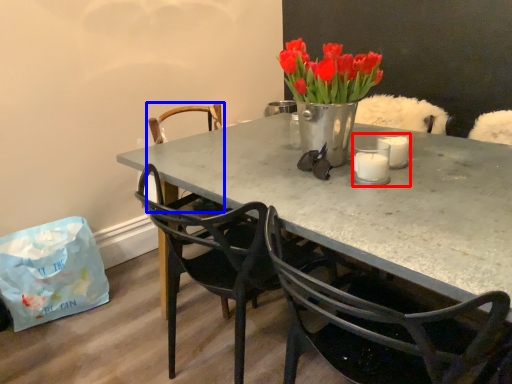
Question: Which point is closer to the camera, candle holder (highlighted by a red box) or chair (highlighted by a blue box)?

Choices:
 (A) candle holder
 (B) chair

Answer: (A)